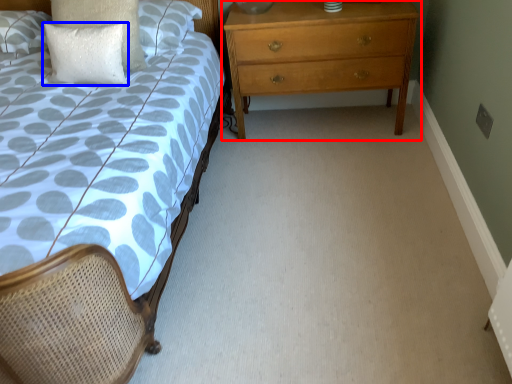
Question: Among these objects, which one is nearest to the camera, chest of drawers (highlighted by a red box) or pillow (highlighted by a blue box)?

Choices:
 (A) chest of drawers
 (B) pillow

Answer: (B)